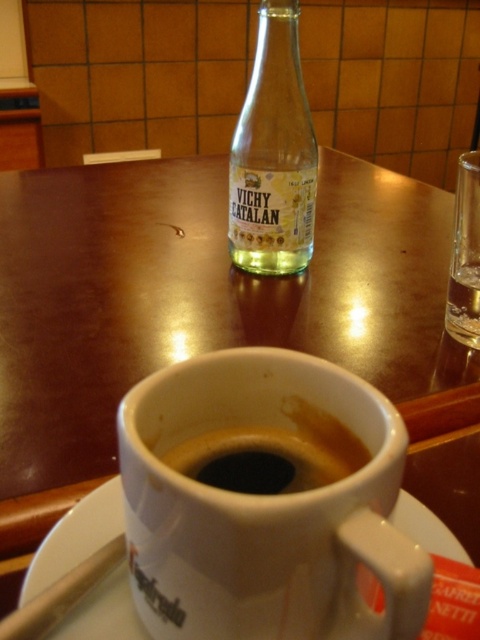
Question: Where is clear glass bottle at center located in relation to clear glass at upper right in the image?

Choices:
 (A) left
 (B) right

Answer: (A)

Question: Which object is farther from the camera taking this photo?

Choices:
 (A) white matte mug at center
 (B) clear glass at upper right
 (C) black matte coffee at center
 (D) clear glass bottle at center

Answer: (D)

Question: Does clear glass bottle at center appear on the left side of clear glass at upper right?

Choices:
 (A) yes
 (B) no

Answer: (A)

Question: Among these objects, which one is nearest to the camera?

Choices:
 (A) clear glass bottle at center
 (B) white matte mug at center
 (C) clear glass at upper right
 (D) black matte coffee at center

Answer: (B)

Question: Which point appears farthest from the camera in this image?

Choices:
 (A) (278, 237)
 (B) (291, 564)

Answer: (A)

Question: Is white matte mug at center to the left of white ceramic saucer at lower center from the viewer's perspective?

Choices:
 (A) yes
 (B) no

Answer: (B)